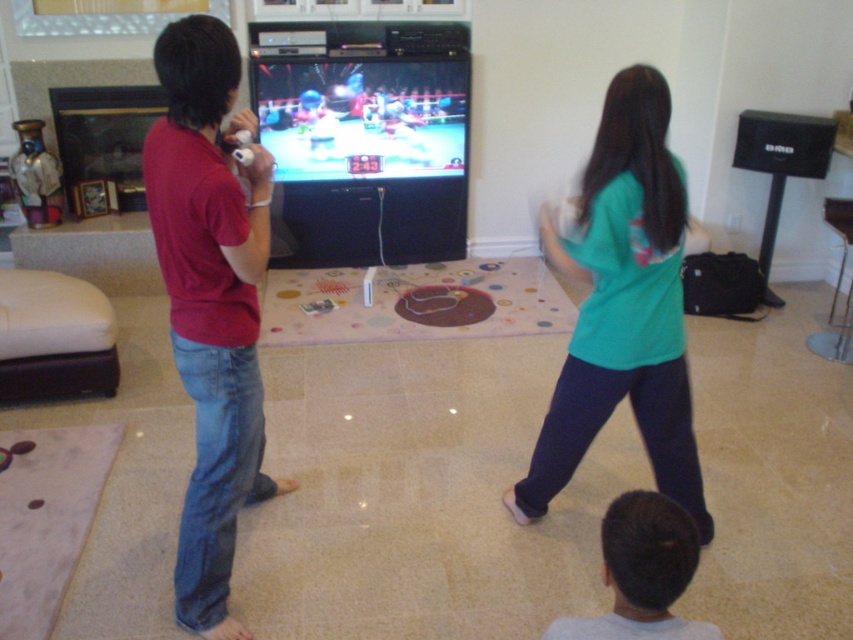
Question: Does teal t-shirt at center have a larger size compared to dark brown hair at lower center?

Choices:
 (A) yes
 (B) no

Answer: (A)

Question: Which of the following is the closest to the observer?

Choices:
 (A) teal t-shirt at center
 (B) dark brown hair at lower center
 (C) matte red shirt at left

Answer: (B)

Question: Which of the following is the farthest from the observer?

Choices:
 (A) matte red shirt at left
 (B) teal t-shirt at center
 (C) dark brown hair at lower center

Answer: (B)

Question: Is matte red shirt at left closer to camera compared to dark brown hair at lower center?

Choices:
 (A) yes
 (B) no

Answer: (B)

Question: Considering the relative positions of teal t-shirt at center and dark brown hair at lower center in the image provided, where is teal t-shirt at center located with respect to dark brown hair at lower center?

Choices:
 (A) left
 (B) right

Answer: (B)

Question: Which object is positioned closest to the matte red shirt at left?

Choices:
 (A) dark brown hair at lower center
 (B) teal t-shirt at center

Answer: (B)